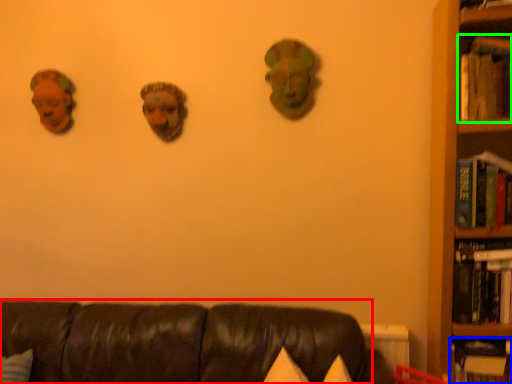
Question: Based on their relative distances, which object is farther from studio couch (highlighted by a red box)? Choose from book (highlighted by a blue box) and book (highlighted by a green box).

Choices:
 (A) book
 (B) book

Answer: (B)